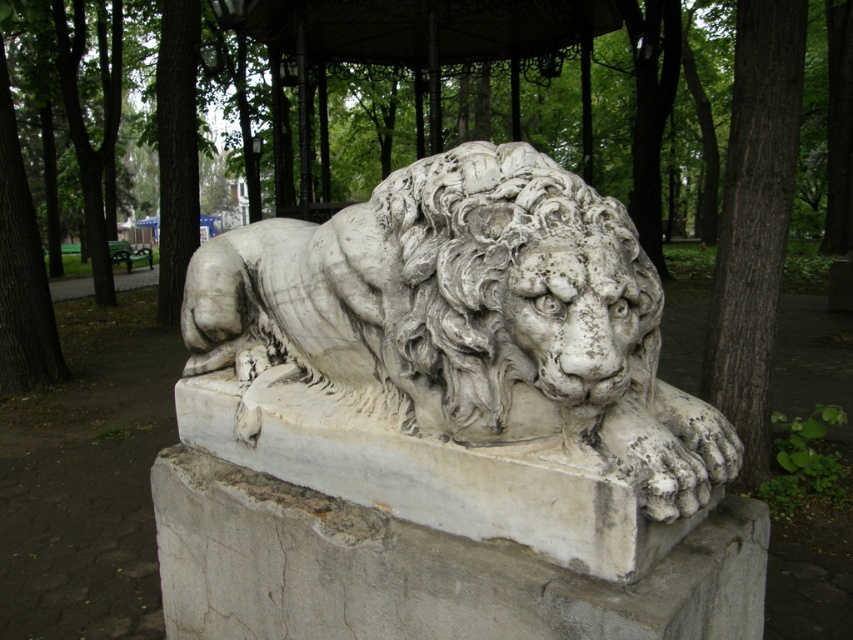
How far apart are white marble lion at center and dark brown bark tree at right?

white marble lion at center is 13.93 feet away from dark brown bark tree at right.

Does white marble lion at center have a greater width compared to dark brown bark tree at right?

Indeed, white marble lion at center has a greater width compared to dark brown bark tree at right.

The height and width of the screenshot is (640, 853). In order to click on white marble lion at center in this screenshot , I will do `click(469, 321)`.